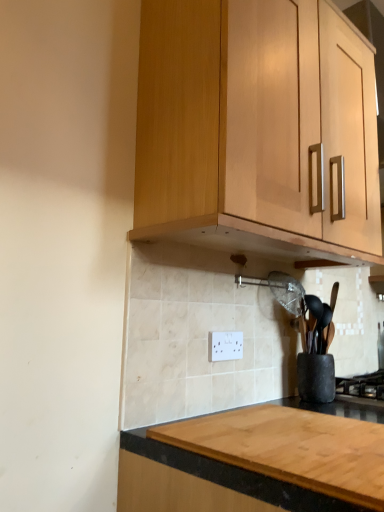
Question: Considering the positions of white plastic electric outlet at center and black matte gas stove at lower right in the image, is white plastic electric outlet at center wider or thinner than black matte gas stove at lower right?

Choices:
 (A) thin
 (B) wide

Answer: (A)

Question: Considering the positions of point (211, 344) and point (375, 398), is point (211, 344) closer or farther from the camera than point (375, 398)?

Choices:
 (A) farther
 (B) closer

Answer: (B)

Question: Estimate the real-world distances between objects in this image. Which object is closer to the black matte gas stove at lower right?

Choices:
 (A) black granite countertop at lower center
 (B) white plastic electric outlet at center
 (C) light wood cabinet at upper center

Answer: (B)

Question: Which object is the closest to the black matte gas stove at lower right?

Choices:
 (A) black granite countertop at lower center
 (B) light wood cabinet at upper center
 (C) white plastic electric outlet at center

Answer: (C)